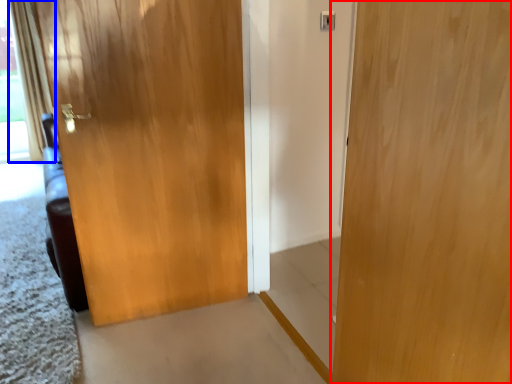
Question: Which object appears closest to the camera in this image, door (highlighted by a red box) or curtain (highlighted by a blue box)?

Choices:
 (A) door
 (B) curtain

Answer: (A)